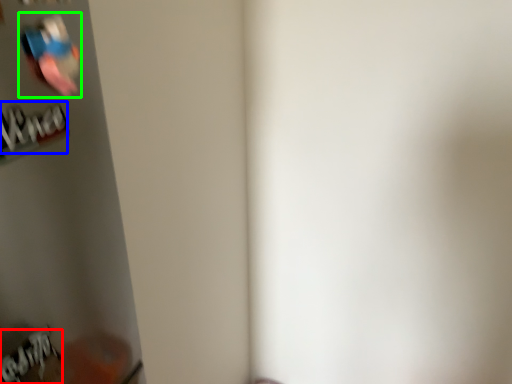
Question: Considering the real-world distances, which object is farthest from writing (highlighted by a red box)? writing (highlighted by a blue box) or Wii controller (highlighted by a green box)?

Choices:
 (A) writing
 (B) Wii controller

Answer: (B)